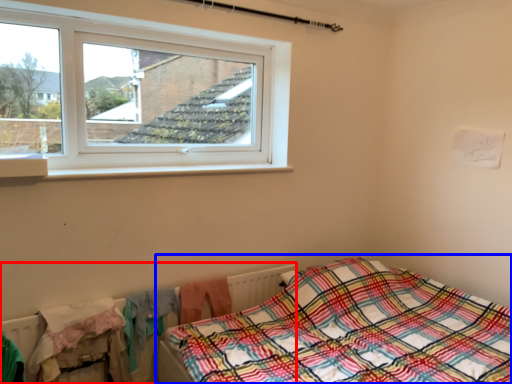
Question: Among these objects, which one is nearest to the camera, radiator (highlighted by a red box) or bed (highlighted by a blue box)?

Choices:
 (A) radiator
 (B) bed

Answer: (B)